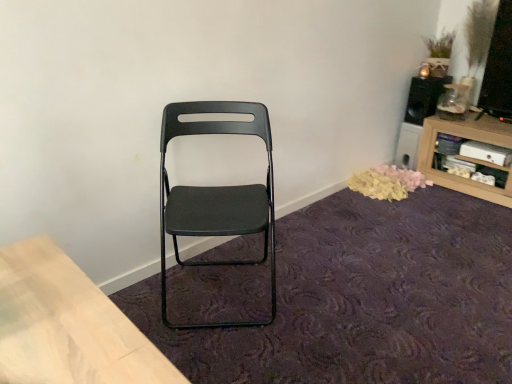
Question: Visually, is matte black folding chair at center positioned to the left or to the right of yellow fabric petals at lower right?

Choices:
 (A) left
 (B) right

Answer: (A)

Question: Is matte black folding chair at center wider or thinner than yellow fabric petals at lower right?

Choices:
 (A) thin
 (B) wide

Answer: (B)

Question: Estimate the real-world distances between objects in this image. Which object is closer to the black matte speaker at upper right?

Choices:
 (A) matte black folding chair at center
 (B) wooden shelf at upper right
 (C) yellow fabric petals at lower right
 (D) black fabric chair at center

Answer: (B)

Question: Which object is positioned farthest from the black fabric chair at center?

Choices:
 (A) black matte speaker at upper right
 (B) wooden shelf at upper right
 (C) yellow fabric petals at lower right
 (D) matte black folding chair at center

Answer: (A)